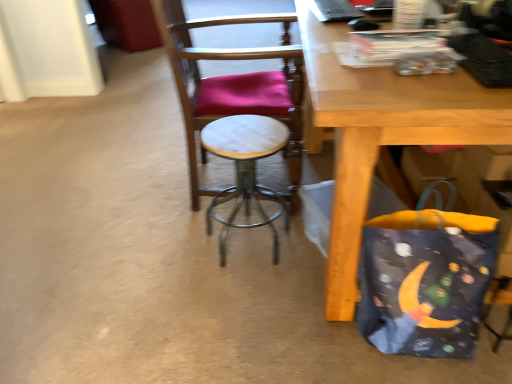
Question: Does dark blue fabric bag at lower right have a smaller size compared to marble seat at center?

Choices:
 (A) yes
 (B) no

Answer: (A)

Question: Is marble seat at center a part of dark blue fabric bag at lower right?

Choices:
 (A) yes
 (B) no

Answer: (B)

Question: Does dark blue fabric bag at lower right turn towards marble seat at center?

Choices:
 (A) no
 (B) yes

Answer: (A)

Question: Are dark blue fabric bag at lower right and marble seat at center far apart?

Choices:
 (A) yes
 (B) no

Answer: (B)

Question: From the image's perspective, is dark blue fabric bag at lower right under marble seat at center?

Choices:
 (A) no
 (B) yes

Answer: (B)

Question: Is dark blue fabric bag at lower right taller or shorter than white marble stool at center?

Choices:
 (A) tall
 (B) short

Answer: (B)

Question: From the image's perspective, is dark blue fabric bag at lower right above or below white marble stool at center?

Choices:
 (A) above
 (B) below

Answer: (B)

Question: From a real-world perspective, relative to white marble stool at center, is dark blue fabric bag at lower right vertically above or below?

Choices:
 (A) above
 (B) below

Answer: (A)

Question: Considering the relative positions of dark blue fabric bag at lower right and white marble stool at center in the image provided, is dark blue fabric bag at lower right to the left or to the right of white marble stool at center?

Choices:
 (A) right
 (B) left

Answer: (A)

Question: Looking at their shapes, would you say white marble stool at center is wider or thinner than marble seat at center?

Choices:
 (A) wide
 (B) thin

Answer: (B)

Question: In the image, is white marble stool at center positioned in front of or behind marble seat at center?

Choices:
 (A) front
 (B) behind

Answer: (A)

Question: Considering the positions of point (249, 135) and point (276, 97), is point (249, 135) closer or farther from the camera than point (276, 97)?

Choices:
 (A) closer
 (B) farther

Answer: (A)

Question: Is white marble stool at center taller or shorter than marble seat at center?

Choices:
 (A) tall
 (B) short

Answer: (B)

Question: Would you say marble seat at center is inside or outside dark blue fabric bag at lower right?

Choices:
 (A) inside
 (B) outside

Answer: (B)

Question: From the image's perspective, is marble seat at center located above or below dark blue fabric bag at lower right?

Choices:
 (A) above
 (B) below

Answer: (A)